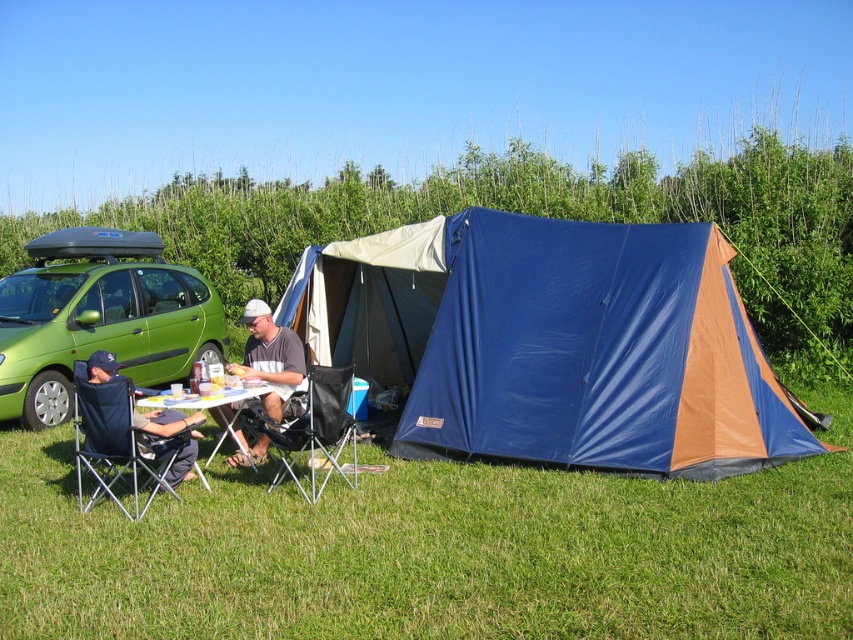
Does dark blue fabric chair at lower left have a smaller size compared to white fabric shirt at center?

Incorrect, dark blue fabric chair at lower left is not smaller in size than white fabric shirt at center.

Does dark blue fabric chair at lower left have a greater width compared to white fabric shirt at center?

Yes.

Does point (88, 397) lie in front of point (287, 381)?

Yes.

Where is `dark blue fabric chair at lower left`? The height and width of the screenshot is (640, 853). dark blue fabric chair at lower left is located at coordinates (126, 436).

Does green matte minivan at left lie behind white plastic table at lower center?

Yes, green matte minivan at left is behind white plastic table at lower center.

Does green matte minivan at left have a lesser height compared to white plastic table at lower center?

No.

Which is in front, point (103, 244) or point (178, 404)?

Positioned in front is point (178, 404).

Locate an element on the screen. The image size is (853, 640). green matte minivan at left is located at coordinates (99, 317).

Can you confirm if black fabric chair at center is smaller than white fabric shirt at center?

Actually, black fabric chair at center might be larger than white fabric shirt at center.

Does black fabric chair at center have a larger size compared to white fabric shirt at center?

Correct, black fabric chair at center is larger in size than white fabric shirt at center.

The height and width of the screenshot is (640, 853). I want to click on black fabric chair at center, so point(315,433).

At what (x,y) coordinates should I click in order to perform the action: click on black fabric chair at center. Please return your answer as a coordinate pair (x, y). The image size is (853, 640). Looking at the image, I should click on pyautogui.click(x=315, y=433).